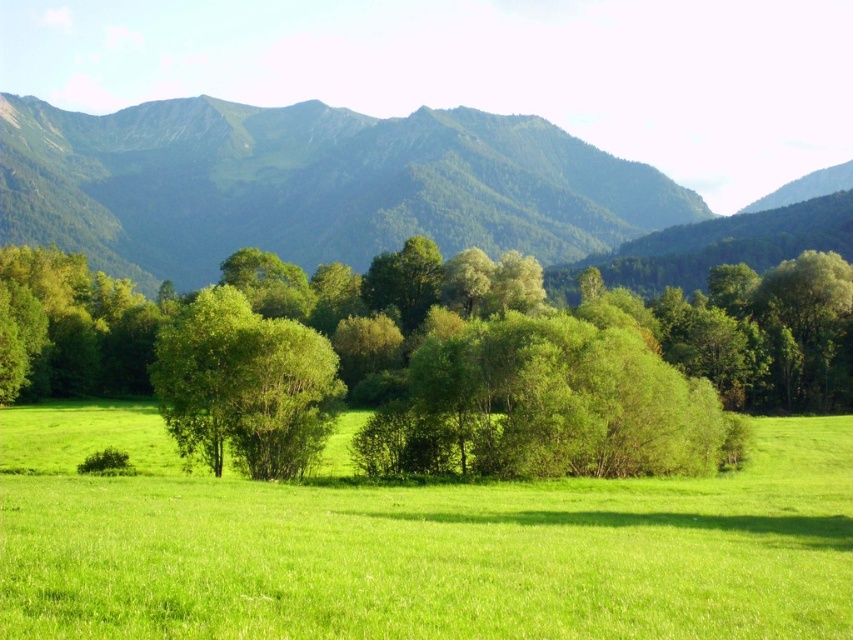
Does green leafy tree at center appear under green textured mountain range at upper center?

Correct, green leafy tree at center is located below green textured mountain range at upper center.

Is point (184, 374) farther from viewer compared to point (160, 108)?

No.

Does point (132, 346) come behind point (383, 214)?

No.

Identify the location of green leafy tree at center. (440, 371).

In the scene shown: Between green grass pasture at center and green textured mountain range at upper center, which one is positioned lower?

green grass pasture at center

Measure the distance between point (140, 483) and camera.

38.31 meters

Where is `green grass pasture at center`? green grass pasture at center is located at coordinates (416, 545).

Is green grass pasture at center to the left of green leafy tree at center from the viewer's perspective?

In fact, green grass pasture at center is to the right of green leafy tree at center.

Does green grass pasture at center have a lesser height compared to green leafy tree at center?

Correct, green grass pasture at center is not as tall as green leafy tree at center.

The width and height of the screenshot is (853, 640). What are the coordinates of `green grass pasture at center` in the screenshot? It's located at (416, 545).